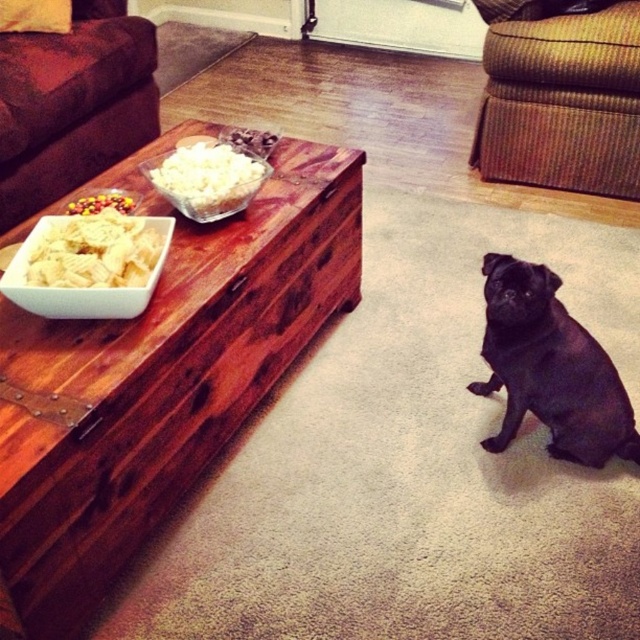
Between brown fabric couch at upper left and white crispy chips at left, which one is positioned higher?

brown fabric couch at upper left is higher up.

Where is `brown fabric couch at upper left`? brown fabric couch at upper left is located at coordinates (72, 104).

Is white crispy chips at left to the left of white popcorn at center from the viewer's perspective?

Yes, white crispy chips at left is to the left of white popcorn at center.

Does point (36, 252) come farther from viewer compared to point (225, 204)?

No, (36, 252) is in front of (225, 204).

The width and height of the screenshot is (640, 640). What do you see at coordinates (93, 252) in the screenshot?
I see `white crispy chips at left` at bounding box center [93, 252].

The image size is (640, 640). What are the coordinates of `white crispy chips at left` in the screenshot? It's located at (93, 252).

Looking at this image, can you confirm if black matte dog at lower right is positioned above shiny metallic nuts at left?

Actually, black matte dog at lower right is below shiny metallic nuts at left.

Between black matte dog at lower right and shiny metallic nuts at left, which one is positioned higher?

shiny metallic nuts at left

Is point (572, 426) positioned behind point (113, 196)?

No, (572, 426) is in front of (113, 196).

Locate an element on the screen. Image resolution: width=640 pixels, height=640 pixels. black matte dog at lower right is located at coordinates (548, 369).